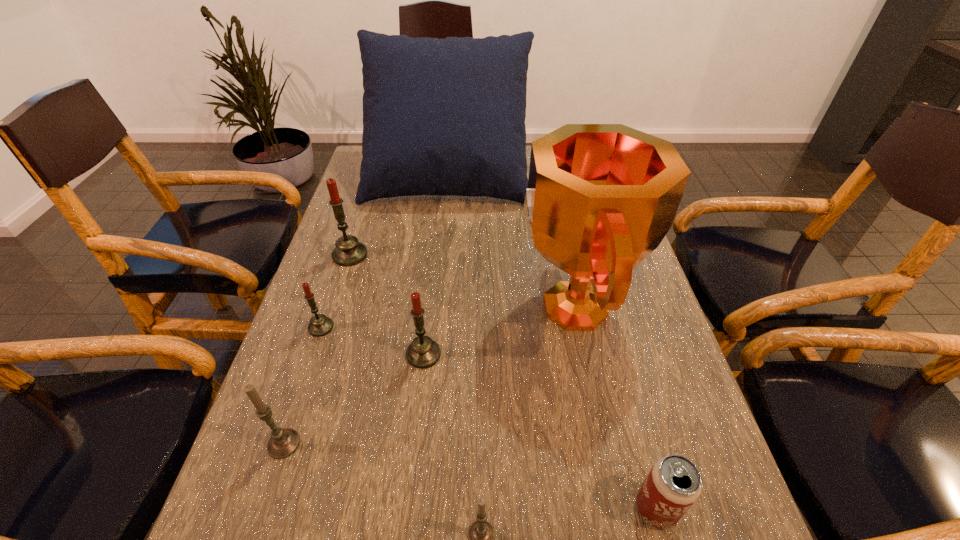
Identify the location of object located in the far edge section of the desktop. The width and height of the screenshot is (960, 540). (442, 117).

Locate an element on the screen. The width and height of the screenshot is (960, 540). cushion that is at the left edge is located at coordinates (442, 117).

Identify the location of award present at the right edge. (601, 197).

Find the location of a particular element. beer can present at the right edge is located at coordinates (673, 484).

Find the location of a particular element. This screenshot has width=960, height=540. object that is at the far left corner is located at coordinates (442, 117).

In order to click on free space at the left edge in this screenshot , I will do `click(342, 266)`.

At what (x,y) coordinates should I click in order to perform the action: click on vacant space at the right edge. Please return your answer as a coordinate pair (x, y). This screenshot has width=960, height=540. Looking at the image, I should click on (636, 469).

The image size is (960, 540). I want to click on free spot between the tallest candle and the award, so click(x=462, y=281).

You are a GUI agent. You are given a task and a screenshot of the screen. Output one action in this format:
    pyautogui.click(x=<x>, y=<y>)
    Task: Click on the free point between the fourth farthest candle and the third farthest candle
    This screenshot has width=960, height=540.
    Given the screenshot: What is the action you would take?
    pyautogui.click(x=353, y=399)

Identify the location of empty space that is in between the smallest red candle and the cushion. The width and height of the screenshot is (960, 540). (384, 252).